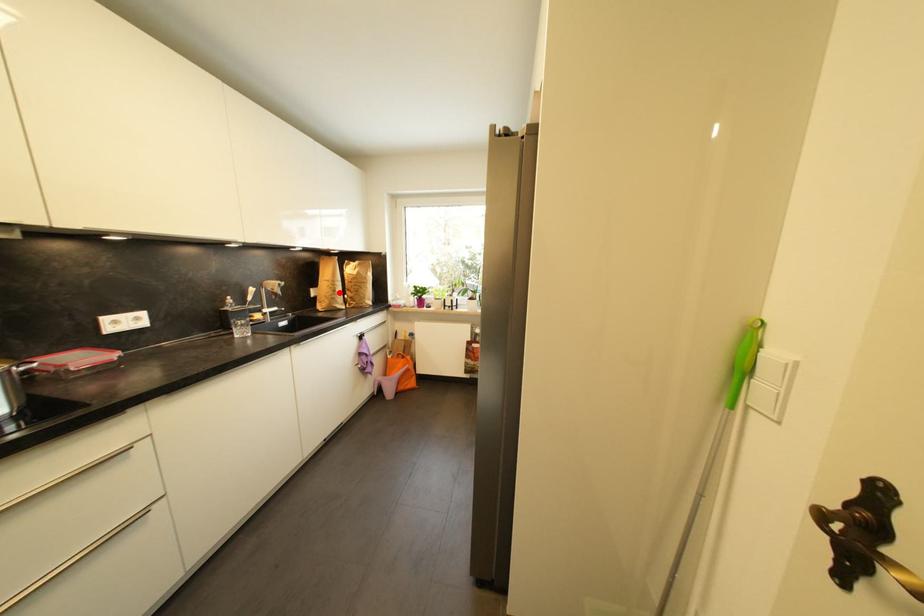
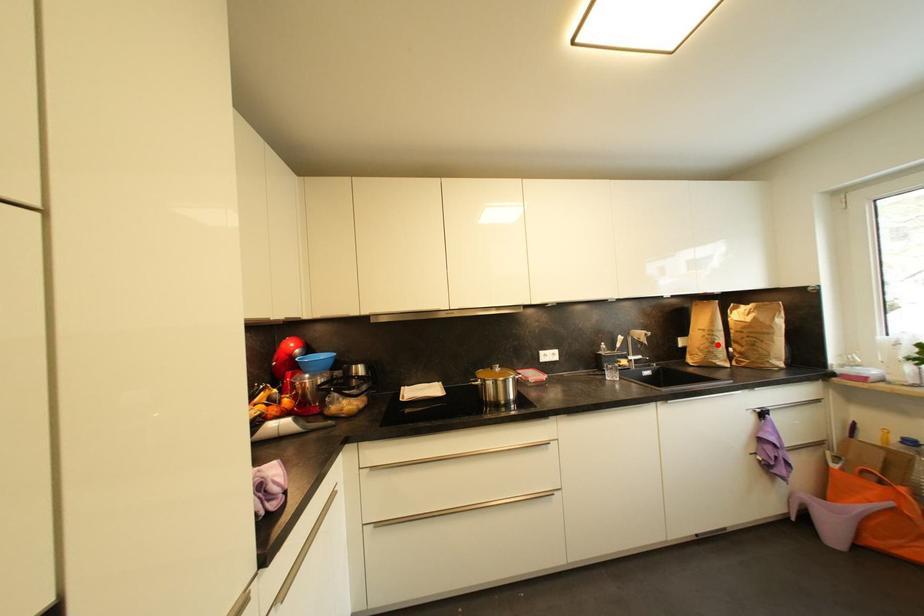
I am providing you with two images of the same scene from different viewpoints. A red point is marked on the first image and another point is marked on the second image. Are the points marked in image1 and image2 representing the same 3D position?

Yes